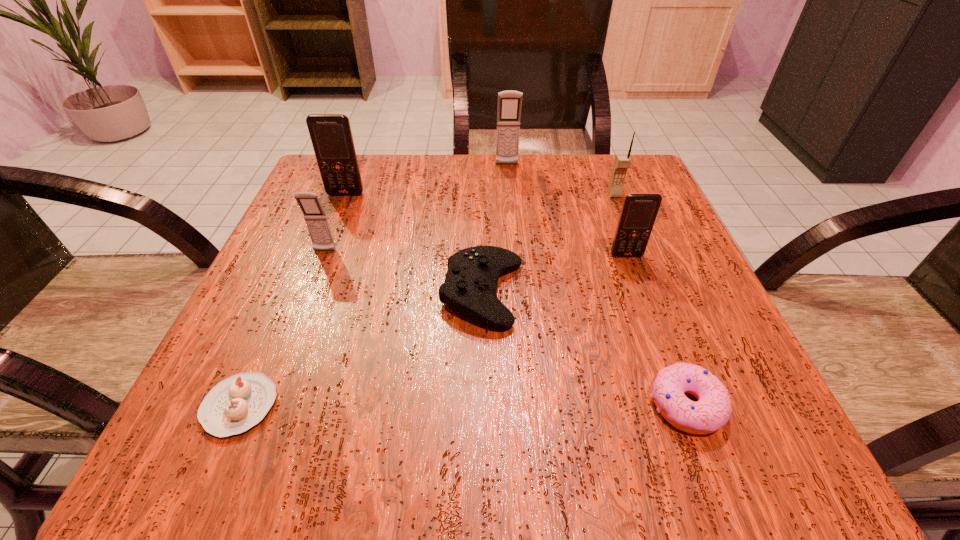
At what (x,y) coordinates should I click in order to perform the action: click on the second closest object to the smaller orange cellular telephone. Please return your answer as a coordinate pair (x, y). The height and width of the screenshot is (540, 960). Looking at the image, I should click on point(622,162).

Choose which object is the fourth nearest neighbor to the cupcake. Please provide its 2D coordinates. Your answer should be formatted as a tuple, i.e. [(x, y)], where the tuple contains the x and y coordinates of a point satisfying the conditions above.

[(712, 411)]

Find the location of a particular element. Image resolution: width=960 pixels, height=540 pixels. cellular telephone identified as the third closest to the cupcake is located at coordinates (639, 211).

The height and width of the screenshot is (540, 960). In order to click on the fifth closest cellular telephone to the third nearest object in this screenshot , I will do `click(509, 102)`.

I want to click on free region that satisfies the following two spatial constraints: 1. on the front-facing side of the farthest cellular telephone; 2. on the right side of the pink doughnut, so click(x=528, y=404).